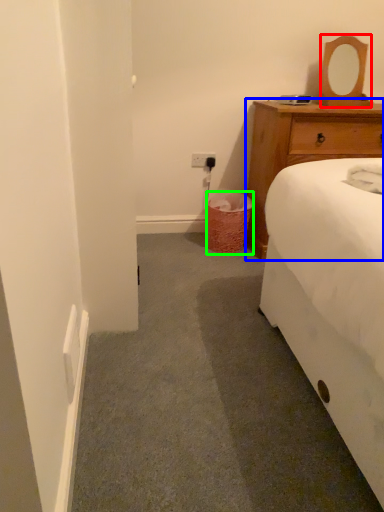
Question: Based on their relative distances, which object is farther from mirror (highlighted by a red box)? Choose from chest of drawers (highlighted by a blue box) and trash bin/can (highlighted by a green box).

Choices:
 (A) chest of drawers
 (B) trash bin/can

Answer: (B)